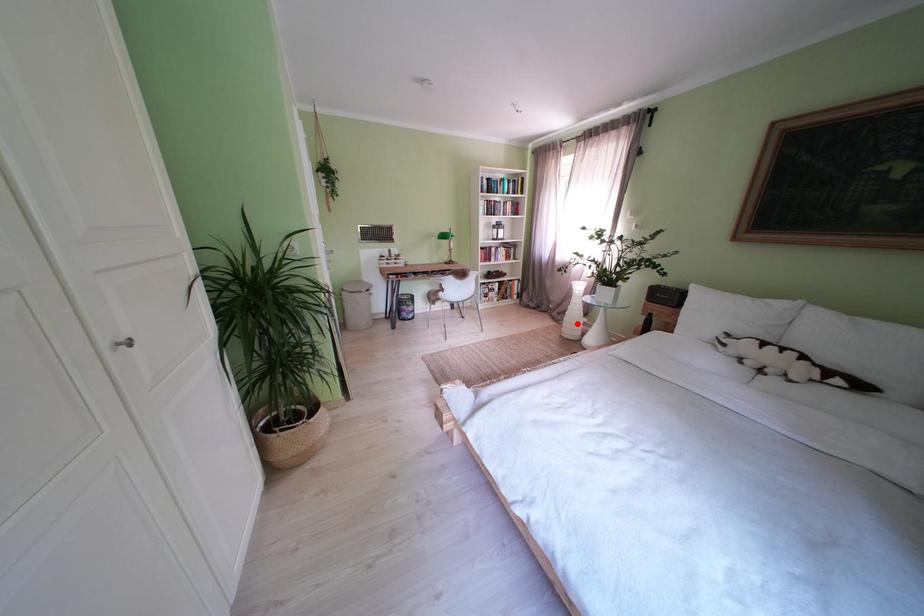
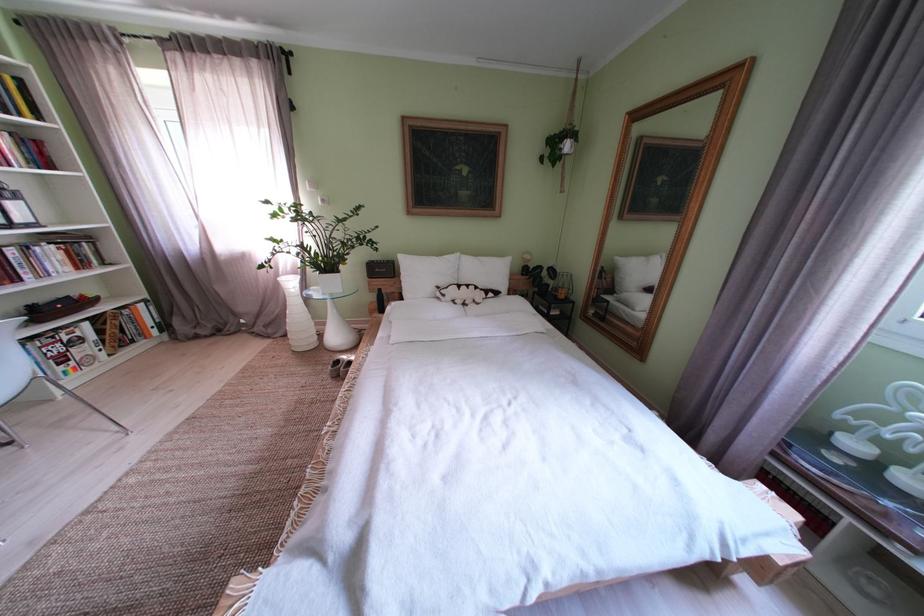
Locate, in the second image, the point that corresponds to the highlighted location in the first image.

(301, 334)